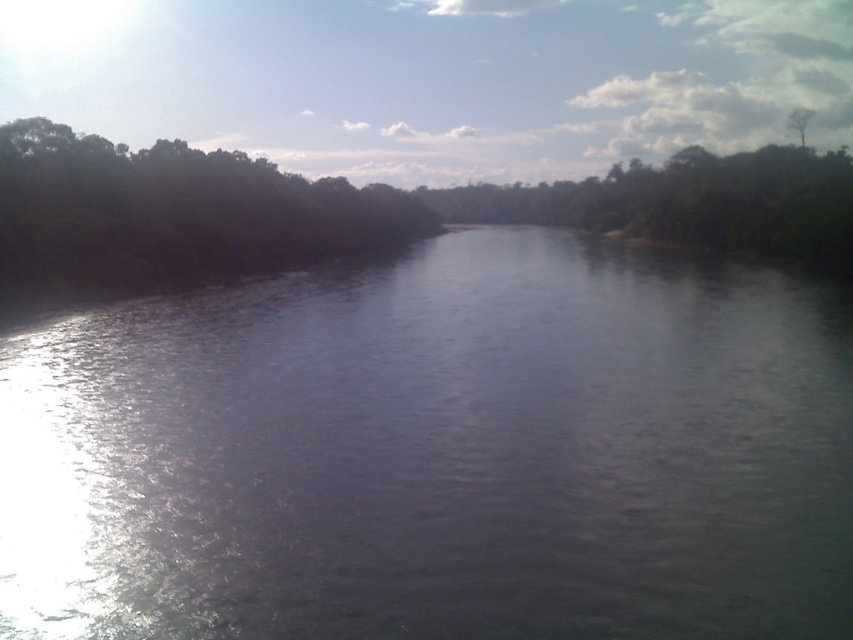
You are an environmental scientist analyzing the river scene. You need to determine which area covers more space in the image between the shiny dark water at center and the dark green leafy trees at left. Which one occupies a larger area?

The dark green leafy trees at left occupy more space than the shiny dark water at center according to the description provided.

You are a photographer planning to capture the reflection of the green leafy tree at upper right in the shiny dark water at center. Based on the scene, will the reflection be fully visible in the water?

The shiny dark water at center has a lesser height compared to green leafy tree at upper right, so the reflection of the green leafy tree at upper right may not be fully visible in the shiny dark water at center because the water is not tall enough to mirror the entire tree.

You are a kayaker planning to navigate the river in the image. You notice a point marked at coordinates (x=437, y=452). What type of water surface condition would you expect to find there?

At point (x=437, y=452) lies shiny dark water at center, indicating calm and reflective water surface conditions suitable for kayaking.